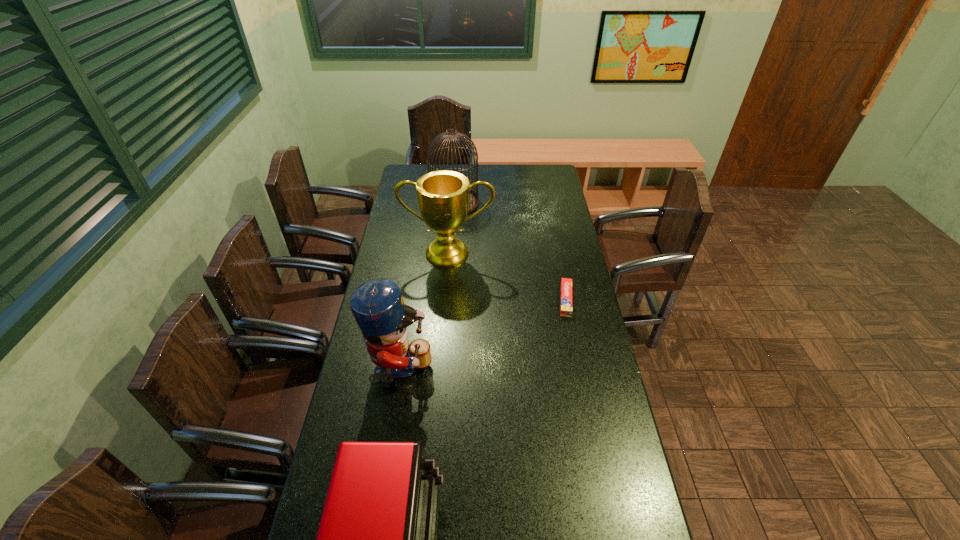
Where is `nutcracker at the left edge`? nutcracker at the left edge is located at coordinates (377, 305).

The width and height of the screenshot is (960, 540). In order to click on object that is positioned at the right edge in this screenshot , I will do `click(566, 284)`.

Locate an element on the screen. free space at the left edge of the desktop is located at coordinates (389, 245).

At what (x,y) coordinates should I click in order to perform the action: click on vacant space at the right edge of the desktop. Please return your answer as a coordinate pair (x, y). Looking at the image, I should click on (557, 232).

In the image, there is a desktop. Identify the location of vacant space at the far right corner. The width and height of the screenshot is (960, 540). (554, 179).

This screenshot has height=540, width=960. In order to click on vacant region between the second nearest object and the award in this screenshot , I will do `click(424, 312)`.

I want to click on free space that is in between the award and the nutcracker, so click(x=424, y=312).

Identify the location of object that is the closest to the farthest object. (443, 196).

Locate which object is the second closest to the farthest object. Please provide its 2D coordinates. Your answer should be formatted as a tuple, i.e. [(x, y)], where the tuple contains the x and y coordinates of a point satisfying the conditions above.

[(566, 284)]

Image resolution: width=960 pixels, height=540 pixels. I want to click on vacant space that satisfies the following two spatial constraints: 1. on the shiny surface of the rightmost object; 2. on the left side of the fourth nearest object, so click(444, 300).